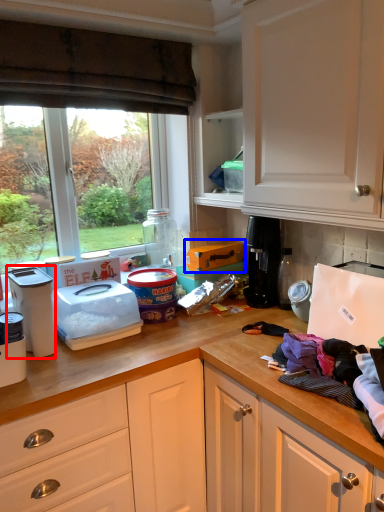
Question: Which object appears farthest to the camera in this image, kitchen appliance (highlighted by a red box) or cardboard box (highlighted by a blue box)?

Choices:
 (A) kitchen appliance
 (B) cardboard box

Answer: (B)